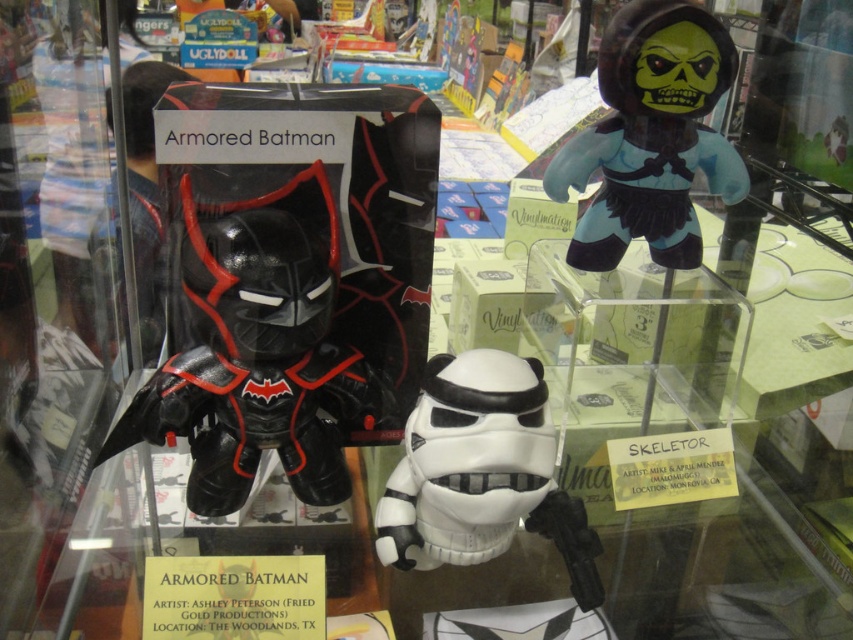
Question: Can you confirm if matte black vinyl figure at center is positioned below matte black figure at upper right?

Choices:
 (A) yes
 (B) no

Answer: (A)

Question: Among these objects, which one is nearest to the camera?

Choices:
 (A) white matte stormtrooper helmet at center
 (B) matte black vinyl figure at center

Answer: (B)

Question: Is matte black vinyl figure at center thinner than matte black figure at upper right?

Choices:
 (A) yes
 (B) no

Answer: (B)

Question: Does matte black vinyl figure at center lie behind matte black figure at upper right?

Choices:
 (A) no
 (B) yes

Answer: (A)

Question: Which of the following is the farthest from the observer?

Choices:
 (A) (527, 426)
 (B) (584, 244)

Answer: (B)

Question: Among these objects, which one is farthest from the camera?

Choices:
 (A) matte black figure at upper right
 (B) matte black vinyl figure at center

Answer: (A)